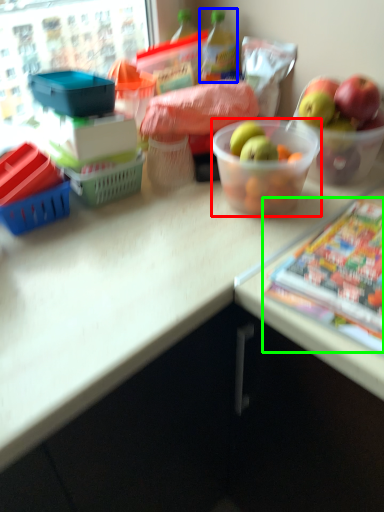
Question: Which is farther away from bowl (highlighted by a red box)? bottle (highlighted by a blue box) or comic book (highlighted by a green box)?

Choices:
 (A) bottle
 (B) comic book

Answer: (A)